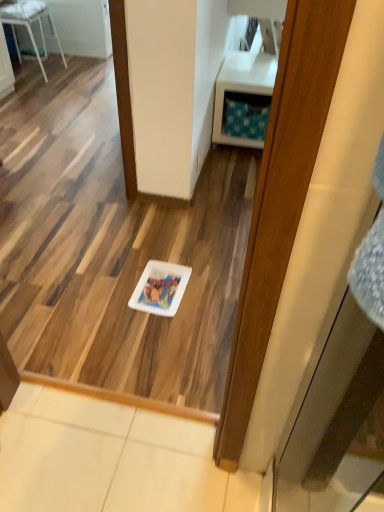
Image resolution: width=384 pixels, height=512 pixels. In order to click on vacant area located to the right-hand side of white glossy plate at center in this screenshot , I will do `click(211, 290)`.